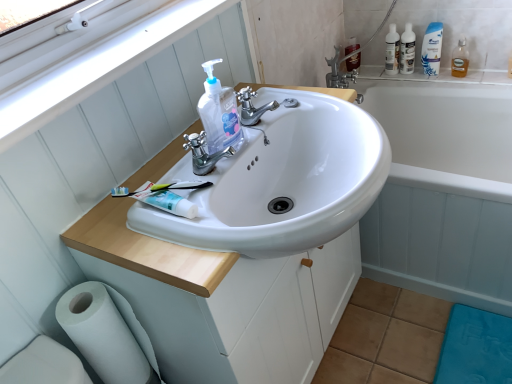
Question: From the image's perspective, is clear plastic hand soap at center, which is the first cleaning product in left-to-right order, below clear plastic bottle at upper right?

Choices:
 (A) yes
 (B) no

Answer: (A)

Question: Is clear plastic hand soap at center, which is the first cleaning product in front-to-back order, next to clear plastic bottle at upper right?

Choices:
 (A) no
 (B) yes

Answer: (A)

Question: Does clear plastic hand soap at center, which is the third cleaning product from back to front, come in front of clear plastic bottle at upper right?

Choices:
 (A) no
 (B) yes

Answer: (B)

Question: Is clear plastic hand soap at center, the first cleaning product ordered from the bottom, to the left of clear plastic bottle at upper right from the viewer's perspective?

Choices:
 (A) yes
 (B) no

Answer: (A)

Question: From a real-world perspective, is clear plastic hand soap at center, which is the first cleaning product in front-to-back order, located higher than clear plastic bottle at upper right?

Choices:
 (A) yes
 (B) no

Answer: (A)

Question: From the image's perspective, relative to clear plastic hand soap at center, the first cleaning product ordered from the bottom, is white glossy shampoo bottle at upper right, which is the 3th cleaning product from bottom to top, above or below?

Choices:
 (A) below
 (B) above

Answer: (B)

Question: Is white glossy shampoo bottle at upper right, the 1th cleaning product viewed from the right, inside or outside of clear plastic hand soap at center, the 3th cleaning product viewed from the top?

Choices:
 (A) inside
 (B) outside

Answer: (B)

Question: Is white glossy shampoo bottle at upper right, the 2th cleaning product in the front-to-back sequence, wider or thinner than clear plastic hand soap at center, the first cleaning product ordered from the bottom?

Choices:
 (A) thin
 (B) wide

Answer: (A)

Question: Is white glossy shampoo bottle at upper right, the first cleaning product when ordered from top to bottom, taller or shorter than clear plastic hand soap at center, which is the third cleaning product from back to front?

Choices:
 (A) short
 (B) tall

Answer: (B)

Question: In the image, is clear plastic bottles at upper right, the 1th mouthwash in the left-to-right sequence, on the left side or the right side of white glossy toothpaste at center?

Choices:
 (A) left
 (B) right

Answer: (B)

Question: Relative to white glossy toothpaste at center, is clear plastic bottles at upper right, the second mouthwash positioned from the right, in front or behind?

Choices:
 (A) front
 (B) behind

Answer: (B)

Question: Considering the positions of point (411, 64) and point (150, 185), is point (411, 64) closer or farther from the camera than point (150, 185)?

Choices:
 (A) farther
 (B) closer

Answer: (A)

Question: Considering the positions of clear plastic bottles at upper right, the 1th mouthwash in the left-to-right sequence, and white glossy toothpaste at center in the image, is clear plastic bottles at upper right, the 1th mouthwash in the left-to-right sequence, bigger or smaller than white glossy toothpaste at center?

Choices:
 (A) big
 (B) small

Answer: (A)

Question: Looking at their shapes, would you say translucent plastic mouthwash at upper right, which is counted as the 1th mouthwash, starting from the right, is wider or thinner than white matte toilet paper at lower left?

Choices:
 (A) thin
 (B) wide

Answer: (A)

Question: From the image's perspective, is translucent plastic mouthwash at upper right, the second mouthwash positioned from the left, above or below white matte toilet paper at lower left?

Choices:
 (A) below
 (B) above

Answer: (B)